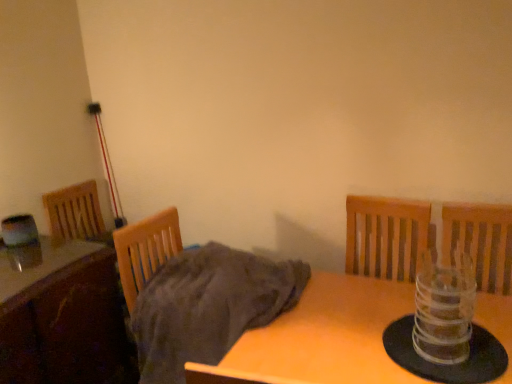
The height and width of the screenshot is (384, 512). I want to click on vacant space situated on the left part of transparent plastic candle holder at right, so click(x=364, y=346).